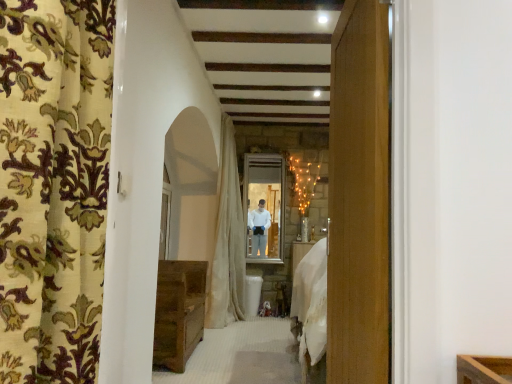
What do you see at coordinates (227, 240) in the screenshot? I see `white textured curtain at center, which is counted as the second curtain, starting from the front` at bounding box center [227, 240].

Identify the location of rustic wood chest at lower left. The width and height of the screenshot is (512, 384). (178, 312).

Is white textured curtain at center, which is counted as the second curtain, starting from the front, not inside floral fabric curtain at left, the 2th curtain positioned from the back?

Yes, white textured curtain at center, which is counted as the second curtain, starting from the front, is not within floral fabric curtain at left, the 2th curtain positioned from the back.

From a real-world perspective, does white textured curtain at center, placed as the 1th curtain when sorted from back to front, stand above floral fabric curtain at left, the 1th curtain positioned from the front?

Correct, in the physical world, white textured curtain at center, placed as the 1th curtain when sorted from back to front, is higher than floral fabric curtain at left, the 1th curtain positioned from the front.

Who is smaller, white textured curtain at center, which is counted as the second curtain, starting from the front, or floral fabric curtain at left, the 2th curtain positioned from the back?

Smaller between the two is floral fabric curtain at left, the 2th curtain positioned from the back.

Which object is closer to the camera taking this photo, white textured curtain at center, which is counted as the second curtain, starting from the front, or floral fabric curtain at left, the 2th curtain positioned from the back?

floral fabric curtain at left, the 2th curtain positioned from the back, is more forward.

From the picture: Is floral fabric curtain at left, the 1th curtain positioned from the front, thinner than rustic wood chest at lower left?

Yes.

Can you tell me how much floral fabric curtain at left, the 1th curtain positioned from the front, and rustic wood chest at lower left differ in facing direction?

There is a 4.42-degree angle between the facing directions of floral fabric curtain at left, the 1th curtain positioned from the front, and rustic wood chest at lower left.

From a real-world perspective, is floral fabric curtain at left, the 1th curtain positioned from the front, under rustic wood chest at lower left?

No, from a real-world perspective, floral fabric curtain at left, the 1th curtain positioned from the front, is not under rustic wood chest at lower left.

Who is bigger, floral fabric curtain at left, the 1th curtain positioned from the front, or rustic wood chest at lower left?

rustic wood chest at lower left.

Considering the sizes of objects white textured curtain at center, which is counted as the second curtain, starting from the front, and rustic wood chest at lower left in the image provided, who is taller, white textured curtain at center, which is counted as the second curtain, starting from the front, or rustic wood chest at lower left?

white textured curtain at center, which is counted as the second curtain, starting from the front.

From the image's perspective, is white textured curtain at center, placed as the 1th curtain when sorted from back to front, located above or below rustic wood chest at lower left?

From the image's perspective, white textured curtain at center, placed as the 1th curtain when sorted from back to front, appears above rustic wood chest at lower left.

Can you tell me how much white textured curtain at center, which is counted as the second curtain, starting from the front, and rustic wood chest at lower left differ in facing direction?

white textured curtain at center, which is counted as the second curtain, starting from the front, and rustic wood chest at lower left are facing 2.26 degrees away from each other.

Considering the positions of points (96, 123) and (165, 244), is point (96, 123) farther from camera compared to point (165, 244)?

No.

Is clear glass window at center, the first window from the left, completely or partially inside floral fabric curtain at left, the 2th curtain positioned from the back?

Actually, clear glass window at center, the first window from the left, is outside floral fabric curtain at left, the 2th curtain positioned from the back.

Locate an element on the screen. The image size is (512, 384). window on the left of floral fabric curtain at left, the 2th curtain positioned from the back is located at coordinates (165, 216).

From the image's perspective, which object appears higher, floral fabric curtain at left, the 2th curtain positioned from the back, or clear glass window at center, positioned as the 2th window in right-to-left order?

floral fabric curtain at left, the 2th curtain positioned from the back, appears higher in the image.

Is white textured curtain at center, placed as the 1th curtain when sorted from back to front, thinner than clear glass window at center, the first window from the left?

In fact, white textured curtain at center, placed as the 1th curtain when sorted from back to front, might be wider than clear glass window at center, the first window from the left.

Would you say white textured curtain at center, which is counted as the second curtain, starting from the front, is a long distance from clear glass window at center, marked as the 1th window in a front-to-back arrangement?

white textured curtain at center, which is counted as the second curtain, starting from the front, is near clear glass window at center, marked as the 1th window in a front-to-back arrangement, not far away.

From the image's perspective, is white textured curtain at center, which is counted as the second curtain, starting from the front, located above or below clear glass window at center, marked as the 1th window in a front-to-back arrangement?

Based on their image positions, white textured curtain at center, which is counted as the second curtain, starting from the front, is located above clear glass window at center, marked as the 1th window in a front-to-back arrangement.

Considering the relative sizes of white textured curtain at center, which is counted as the second curtain, starting from the front, and clear glass window at center, the first window from the left, in the image provided, is white textured curtain at center, which is counted as the second curtain, starting from the front, taller than clear glass window at center, the first window from the left,?

Yes, white textured curtain at center, which is counted as the second curtain, starting from the front, is taller than clear glass window at center, the first window from the left.

Considering the relative sizes of clear glass window at center, which ranks as the 1th window in back-to-front order, and rustic wood chest at lower left in the image provided, is clear glass window at center, which ranks as the 1th window in back-to-front order, taller than rustic wood chest at lower left?

Yes, clear glass window at center, which ranks as the 1th window in back-to-front order, is taller than rustic wood chest at lower left.

Does clear glass window at center, which is counted as the second window, starting from the front, have a greater width compared to rustic wood chest at lower left?

No, clear glass window at center, which is counted as the second window, starting from the front, is not wider than rustic wood chest at lower left.

Image resolution: width=512 pixels, height=384 pixels. I want to click on furniture lying on the left of clear glass window at center, which is counted as the second window, starting from the front, so click(x=178, y=312).

Can you confirm if clear glass window at center, the first window from the left, is smaller than floral fabric curtain at left, the 2th curtain positioned from the back?

Yes, clear glass window at center, the first window from the left, is smaller than floral fabric curtain at left, the 2th curtain positioned from the back.

I want to click on window that is the 1st object located behind the floral fabric curtain at left, the 2th curtain positioned from the back, so click(x=165, y=216).

Is clear glass window at center, which appears as the second window when viewed from the back, in contact with floral fabric curtain at left, the 2th curtain positioned from the back?

No, clear glass window at center, which appears as the second window when viewed from the back, is not making contact with floral fabric curtain at left, the 2th curtain positioned from the back.

Which object is further away from the camera, clear glass window at center, marked as the 1th window in a front-to-back arrangement, or floral fabric curtain at left, the 2th curtain positioned from the back?

clear glass window at center, marked as the 1th window in a front-to-back arrangement.

Where is `curtain above the floral fabric curtain at left, the 2th curtain positioned from the back (from a real-world perspective)`? curtain above the floral fabric curtain at left, the 2th curtain positioned from the back (from a real-world perspective) is located at coordinates (227, 240).

What are the coordinates of `furniture behind the floral fabric curtain at left, the 2th curtain positioned from the back` in the screenshot? It's located at (178, 312).

From the image, which object appears to be farther from floral fabric curtain at left, the 2th curtain positioned from the back, rustic wood chest at lower left or clear glass window at center, which ranks as the 1th window in back-to-front order?

clear glass window at center, which ranks as the 1th window in back-to-front order, is positioned further to the anchor floral fabric curtain at left, the 2th curtain positioned from the back.

Consider the image. From the image, which object appears to be nearer to rustic wood chest at lower left, clear glass window at center, which ranks as the second window in left-to-right order, or floral fabric curtain at left, the 1th curtain positioned from the front?

clear glass window at center, which ranks as the second window in left-to-right order.

Based on their spatial positions, is rustic wood chest at lower left or clear glass window at center, the first window from the left, closer to floral fabric curtain at left, the 1th curtain positioned from the front?

Among the two, rustic wood chest at lower left is located nearer to floral fabric curtain at left, the 1th curtain positioned from the front.

Which object lies further to the anchor point rustic wood chest at lower left, white textured curtain at center, which is counted as the second curtain, starting from the front, or clear glass window at center, which is counted as the second window, starting from the front?

clear glass window at center, which is counted as the second window, starting from the front, lies further to rustic wood chest at lower left than the other object.

Looking at the image, which one is located closer to floral fabric curtain at left, the 1th curtain positioned from the front, clear glass window at center, the first window from the left, or white textured curtain at center, placed as the 1th curtain when sorted from back to front?

clear glass window at center, the first window from the left, is positioned closer to the anchor floral fabric curtain at left, the 1th curtain positioned from the front.

Considering their positions, is clear glass window at center, marked as the 1th window in a right-to-left arrangement, positioned closer to white textured curtain at center, which is counted as the second curtain, starting from the front, than rustic wood chest at lower left?

The object closer to white textured curtain at center, which is counted as the second curtain, starting from the front, is clear glass window at center, marked as the 1th window in a right-to-left arrangement.

Considering their positions, is white textured curtain at center, placed as the 1th curtain when sorted from back to front, positioned closer to rustic wood chest at lower left than floral fabric curtain at left, the 2th curtain positioned from the back?

white textured curtain at center, placed as the 1th curtain when sorted from back to front, lies closer to rustic wood chest at lower left than the other object.

Estimate the real-world distances between objects in this image. Which object is further from rustic wood chest at lower left, clear glass window at center, marked as the 1th window in a front-to-back arrangement, or floral fabric curtain at left, the 2th curtain positioned from the back?

floral fabric curtain at left, the 2th curtain positioned from the back, is positioned further to the anchor rustic wood chest at lower left.

Locate an element on the screen. The height and width of the screenshot is (384, 512). window located between floral fabric curtain at left, the 2th curtain positioned from the back, and white textured curtain at center, placed as the 1th curtain when sorted from back to front, in the depth direction is located at coordinates (165, 216).

Where is `curtain between clear glass window at center, positioned as the 2th window in right-to-left order, and clear glass window at center, which ranks as the second window in left-to-right order, in the front-back direction`? The height and width of the screenshot is (384, 512). curtain between clear glass window at center, positioned as the 2th window in right-to-left order, and clear glass window at center, which ranks as the second window in left-to-right order, in the front-back direction is located at coordinates (227, 240).

Where is `window positioned between rustic wood chest at lower left and clear glass window at center, which ranks as the second window in left-to-right order, from near to far`? The width and height of the screenshot is (512, 384). window positioned between rustic wood chest at lower left and clear glass window at center, which ranks as the second window in left-to-right order, from near to far is located at coordinates (165, 216).

Where is `furniture positioned between floral fabric curtain at left, the 1th curtain positioned from the front, and clear glass window at center, marked as the 1th window in a right-to-left arrangement, from near to far`? This screenshot has width=512, height=384. furniture positioned between floral fabric curtain at left, the 1th curtain positioned from the front, and clear glass window at center, marked as the 1th window in a right-to-left arrangement, from near to far is located at coordinates (178, 312).